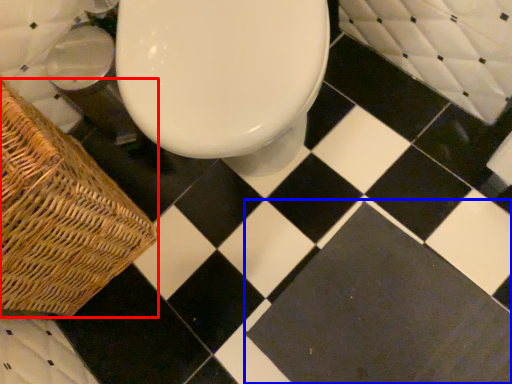
Question: Which object is further to the camera taking this photo, picnic basket (highlighted by a red box) or square (highlighted by a blue box)?

Choices:
 (A) picnic basket
 (B) square

Answer: (B)